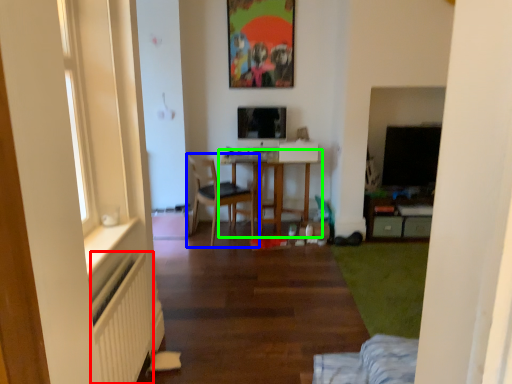
Question: Estimate the real-world distances between objects in this image. Which object is closer to radiator (highlighted by a red box), chair (highlighted by a blue box) or table (highlighted by a green box)?

Choices:
 (A) chair
 (B) table

Answer: (A)